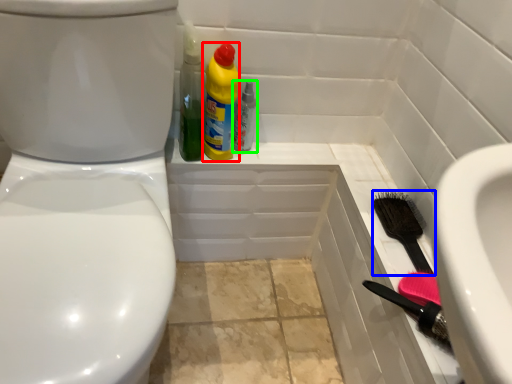
Question: Which is farther away from cleaning product (highlighted by a red box)? brush (highlighted by a blue box) or bottle (highlighted by a green box)?

Choices:
 (A) brush
 (B) bottle

Answer: (A)